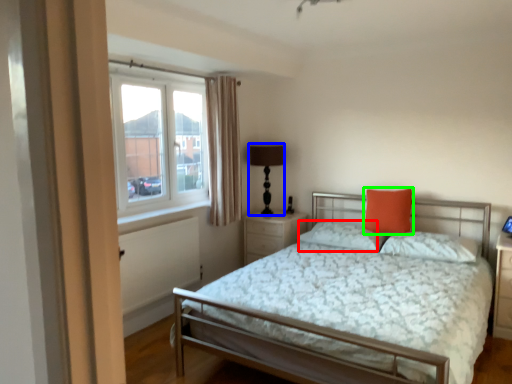
Question: Which object is positioned farthest from pillow (highlighted by a red box)? Select from table lamp (highlighted by a blue box) and pillow (highlighted by a green box).

Choices:
 (A) table lamp
 (B) pillow

Answer: (A)